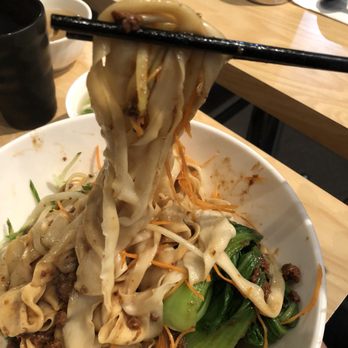
The height and width of the screenshot is (348, 348). Find the location of `tables`. tables is located at coordinates (326, 215), (324, 90).